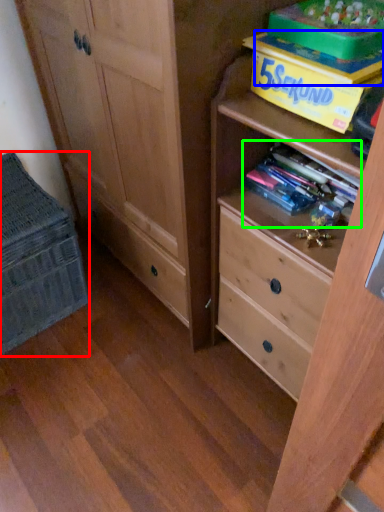
Question: Which object is positioned closest to cabinetry (highlighted by a red box)? Select from book (highlighted by a blue box) and book (highlighted by a green box).

Choices:
 (A) book
 (B) book

Answer: (B)